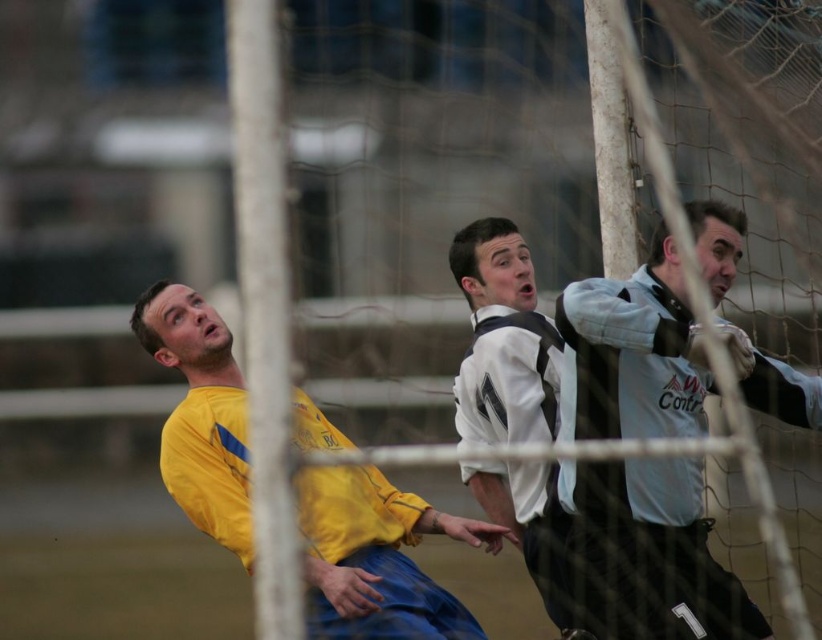
Looking at this image, you are a soccer player trying to score a goal. You notice the white mesh net at center and the white jersey at center. Which object is bigger in size?

The white mesh net at center is larger in size than the white jersey at center.

You are a soccer referee observing the match through the goalpost netting. You notice the yellow jersey at left and the white matte jersey at center. Based on their sizes, which player is likely closer to the netting?

The yellow jersey at left is larger in size compared to the white matte jersey at center, indicating that the player in the yellow jersey at left is closer to the netting.